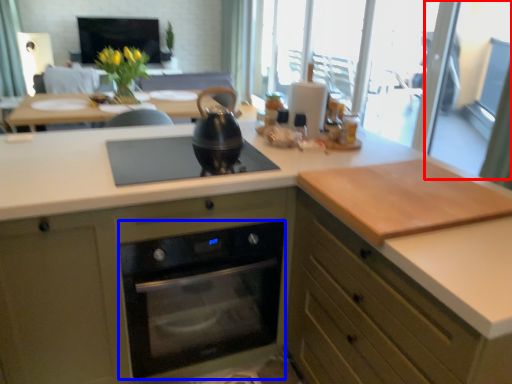
Question: Which object appears farthest to the camera in this image, screen door (highlighted by a red box) or home appliance (highlighted by a blue box)?

Choices:
 (A) screen door
 (B) home appliance

Answer: (A)